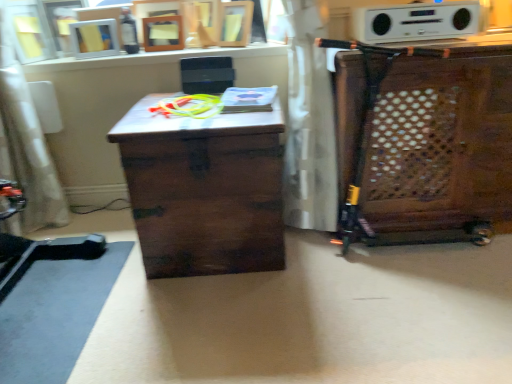
What do you see at coordinates (30, 153) in the screenshot? I see `white fabric swivel chair at left` at bounding box center [30, 153].

What is the approximate width of white matte picture frame at upper left?

It is 7.01 centimeters.

The height and width of the screenshot is (384, 512). What do you see at coordinates (189, 106) in the screenshot?
I see `green rubber toy at center` at bounding box center [189, 106].

Describe the element at coordinates (425, 141) in the screenshot. The width and height of the screenshot is (512, 384). I see `wooden cabinet at right` at that location.

I want to click on white fabric swivel chair at left, so click(30, 153).

Is white matte picture frame at upper left positioned with its back to white fabric swivel chair at left?

white matte picture frame at upper left is not turned away from white fabric swivel chair at left.

Considering the positions of objects white matte picture frame at upper left and white fabric swivel chair at left in the image provided, who is behind, white matte picture frame at upper left or white fabric swivel chair at left?

white matte picture frame at upper left is further from the camera.

Can you see white matte picture frame at upper left touching white fabric swivel chair at left?

They are not placed beside each other.

Considering the sizes of objects white matte picture frame at upper left and white fabric swivel chair at left in the image provided, who is thinner, white matte picture frame at upper left or white fabric swivel chair at left?

white matte picture frame at upper left is thinner.

Looking at this image, could you tell me if wooden cabinet at right is facing white plastic stereo at upper center?

No, wooden cabinet at right does not turn towards white plastic stereo at upper center.

Where is `stereo located on the left of wooden cabinet at right`? This screenshot has height=384, width=512. stereo located on the left of wooden cabinet at right is located at coordinates (416, 22).

Who is smaller, wooden cabinet at right or white plastic stereo at upper center?

Smaller between the two is white plastic stereo at upper center.

From the image's perspective, which object appears higher, white matte picture frame at upper left or wooden cabinet at right?

From the image's view, white matte picture frame at upper left is above.

Consider the image. Is the surface of white matte picture frame at upper left in direct contact with wooden cabinet at right?

No, white matte picture frame at upper left is not making contact with wooden cabinet at right.

Is point (111, 38) closer or farther from the camera than point (425, 223)?

Point (111, 38) is farther from the camera than point (425, 223).

Between white matte picture frame at upper left and wooden cabinet at right, which one has smaller size?

white matte picture frame at upper left.

Can you confirm if dark wood trunk at center is thinner than green rubber toy at center?

In fact, dark wood trunk at center might be wider than green rubber toy at center.

At what (x,y) coordinates should I click in order to perform the action: click on table to the right of green rubber toy at center. Please return your answer as a coordinate pair (x, y). Image resolution: width=512 pixels, height=384 pixels. Looking at the image, I should click on (204, 190).

Which is more to the left, dark wood trunk at center or green rubber toy at center?

green rubber toy at center is more to the left.

From a real-world perspective, is dark wood trunk at center above or below green rubber toy at center?

In terms of real-world spatial position, dark wood trunk at center is below green rubber toy at center.

Which is in front, point (140, 137) or point (474, 173)?

Positioned in front is point (140, 137).

From the image's perspective, who appears lower, dark wood trunk at center or wooden cabinet at right?

From the image's view, dark wood trunk at center is below.

Can you see dark wood trunk at center touching wooden cabinet at right?

No.

Is dark wood trunk at center oriented away from wooden cabinet at right?

No.

In terms of height, does white matte picture frame at upper left look taller or shorter compared to white plastic stereo at upper center?

In the image, white matte picture frame at upper left appears to be taller than white plastic stereo at upper center.

Is white matte picture frame at upper left beside white plastic stereo at upper center?

There is a gap between white matte picture frame at upper left and white plastic stereo at upper center.

The height and width of the screenshot is (384, 512). Identify the location of picture frame below the white plastic stereo at upper center (from a real-world perspective). (94, 38).

Does white matte picture frame at upper left turn towards dark wood trunk at center?

No, white matte picture frame at upper left is not aimed at dark wood trunk at center.

Is white matte picture frame at upper left beside dark wood trunk at center?

No, white matte picture frame at upper left is not touching dark wood trunk at center.

Can you confirm if white matte picture frame at upper left is bigger than dark wood trunk at center?

Actually, white matte picture frame at upper left might be smaller than dark wood trunk at center.

Is white matte picture frame at upper left completely or partially outside of dark wood trunk at center?

Absolutely, white matte picture frame at upper left is external to dark wood trunk at center.

This screenshot has height=384, width=512. What are the coordinates of `swivel chair beneath the white matte picture frame at upper left (from a real-world perspective)` in the screenshot? It's located at (30, 153).

Locate an element on the screen. The image size is (512, 384). cabinetry that appears below the white plastic stereo at upper center (from the image's perspective) is located at coordinates (425, 141).

Looking at the image, which one is located further to wooden cabinet at right, dark wood trunk at center or white fabric swivel chair at left?

Based on the image, white fabric swivel chair at left appears to be further to wooden cabinet at right.

Considering their positions, is green rubber toy at center positioned further to white matte picture frame at upper left than white fabric swivel chair at left?

green rubber toy at center is further to white matte picture frame at upper left.

In the scene shown: Which object lies further to the anchor point white matte picture frame at upper left, wooden cabinet at right or white plastic stereo at upper center?

The object further to white matte picture frame at upper left is wooden cabinet at right.

Which object lies nearer to the anchor point white matte picture frame at upper left, dark wood trunk at center or wooden cabinet at right?

Among the two, dark wood trunk at center is located nearer to white matte picture frame at upper left.

Looking at the image, which one is located further to white matte picture frame at upper left, wooden cabinet at right or dark wood trunk at center?

wooden cabinet at right.

Considering their positions, is wooden cabinet at right positioned further to white plastic stereo at upper center than white fabric swivel chair at left?

white fabric swivel chair at left is further to white plastic stereo at upper center.

Estimate the real-world distances between objects in this image. Which object is further from white fabric swivel chair at left, white plastic stereo at upper center or dark wood trunk at center?

white plastic stereo at upper center is positioned further to the anchor white fabric swivel chair at left.

Considering their positions, is white fabric swivel chair at left positioned further to wooden cabinet at right than green rubber toy at center?

Answer: white fabric swivel chair at left lies further to wooden cabinet at right than the other object.

Identify the location of table between white matte picture frame at upper left and white plastic stereo at upper center in the horizontal direction. (204, 190).

The image size is (512, 384). In order to click on table situated between white matte picture frame at upper left and wooden cabinet at right from left to right in this screenshot , I will do `click(204, 190)`.

Identify the location of toy between white matte picture frame at upper left and white plastic stereo at upper center from left to right. The height and width of the screenshot is (384, 512). 189,106.

In order to click on toy located between white fabric swivel chair at left and dark wood trunk at center in the left-right direction in this screenshot , I will do `click(189, 106)`.